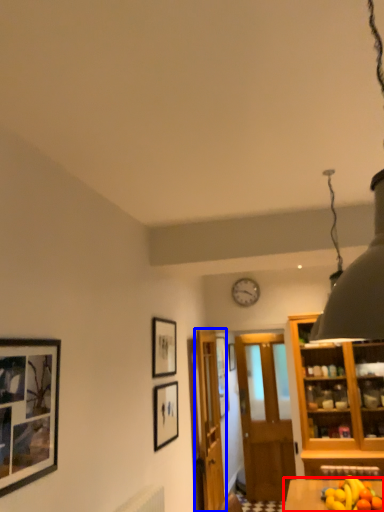
Question: Which of the following is the farthest to the observer, table (highlighted by a red box) or door (highlighted by a blue box)?

Choices:
 (A) table
 (B) door

Answer: (B)